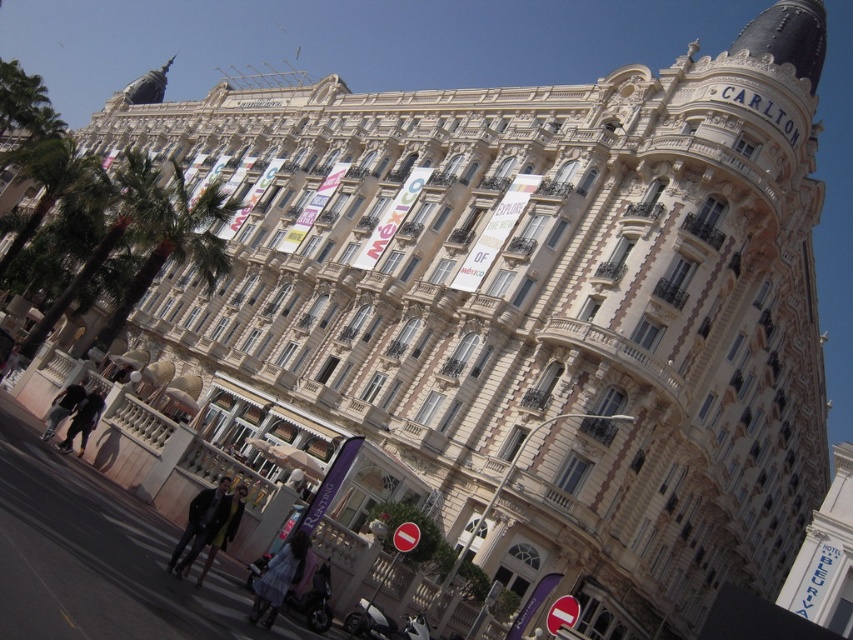
Question: Which of the following is the closest to the observer?

Choices:
 (A) black leather pants at lower left
 (B) light blue denim dress at lower center

Answer: (B)

Question: Which point is closer to the camera taking this photo?

Choices:
 (A) (236, 490)
 (B) (70, 394)
 (C) (252, 608)
 (D) (86, 408)

Answer: (C)

Question: Can you confirm if leather jacket at lower center is smaller than black leather pants at lower left?

Choices:
 (A) no
 (B) yes

Answer: (B)

Question: Does dark brown leather jacket at lower left appear on the right side of black leather pants at lower left?

Choices:
 (A) no
 (B) yes

Answer: (B)

Question: Does light blue denim dress at lower center have a smaller size compared to dark brown leather jacket at lower left?

Choices:
 (A) no
 (B) yes

Answer: (A)

Question: Which point is closer to the camera taking this photo?

Choices:
 (A) (260, 612)
 (B) (230, 520)

Answer: (A)